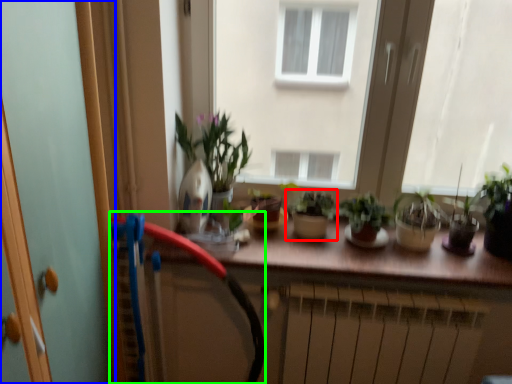
Question: Which object is the farthest from houseplant (highlighted by a red box)? Choose among these: screen door (highlighted by a blue box) or garden hose (highlighted by a green box).

Choices:
 (A) screen door
 (B) garden hose

Answer: (A)